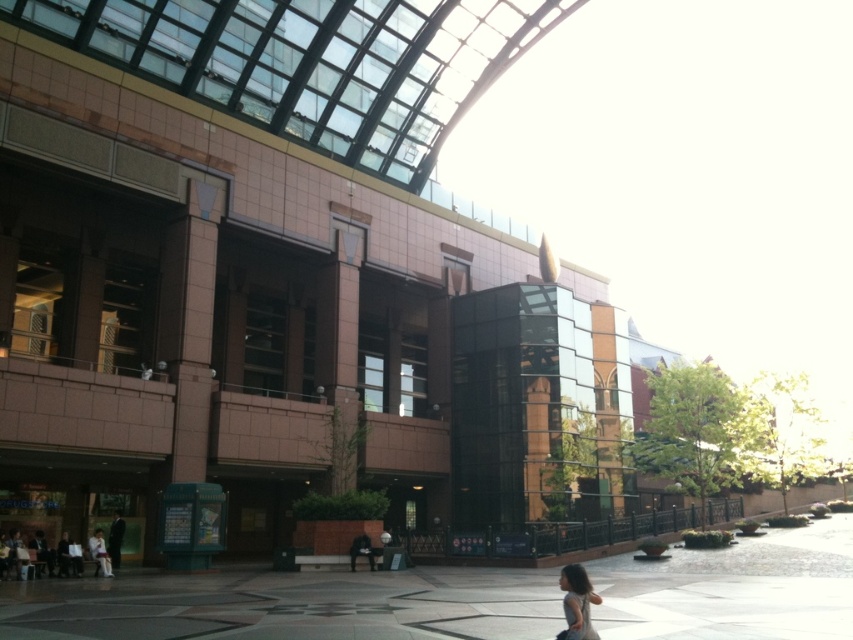
You are a photographer planning to capture a photo of the matte black dress at lower right and the light beige fabric jacket at lower left in the plaza. Considering their sizes, which one should you focus on to ensure it stands out more in the composition?

The matte black dress at lower right is bigger than the light beige fabric jacket at lower left, so focusing on the matte black dress at lower right would make it stand out more due to its larger size.

You are standing at the entrance of the building and want to reach the polished concrete pavement at lower center. According to the image, where should you walk to? Please provide the coordinates in the format of point followed by numbers like point (289, 605).

The polished concrete pavement at lower center is located at point (289, 605), so you should walk towards that coordinate.